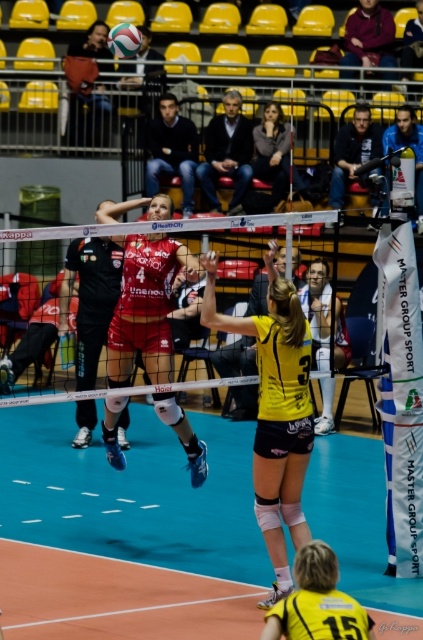
Question: Among these points, which one is nearest to the camera?

Choices:
 (A) (310, 218)
 (B) (169, 333)
 (C) (139, 44)

Answer: (A)

Question: Is matte red volleyball player at center positioned before white mesh net at center?

Choices:
 (A) yes
 (B) no

Answer: (B)

Question: Does yellow jersey at center have a lesser width compared to matte red volleyball player at center?

Choices:
 (A) no
 (B) yes

Answer: (B)

Question: Which object appears farthest from the camera in this image?

Choices:
 (A) yellow jersey at center
 (B) dark gray fabric jacket at upper center
 (C) yellow matte volleyball at upper center

Answer: (B)

Question: Is matte red volleyball player at center to the right of white mesh net at center from the viewer's perspective?

Choices:
 (A) yes
 (B) no

Answer: (A)

Question: Which of the following is the closest to the observer?

Choices:
 (A) (283, 445)
 (B) (162, 237)

Answer: (A)